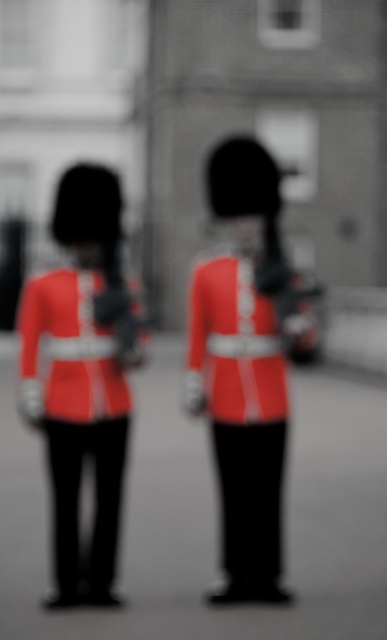
Between matte red uniform at center and matte red uniform at left, which one appears on the right side from the viewer's perspective?

Positioned to the right is matte red uniform at center.

Does matte red uniform at center have a smaller size compared to matte red uniform at left?

Yes.

The height and width of the screenshot is (640, 387). Describe the element at coordinates (241, 412) in the screenshot. I see `matte red uniform at center` at that location.

Where is `matte red uniform at center`? matte red uniform at center is located at coordinates (241, 412).